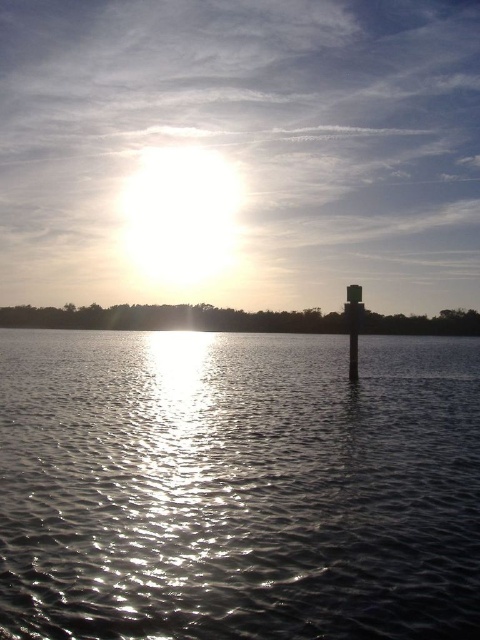
Question: Which object appears closest to the camera in this image?

Choices:
 (A) glistening silver water at center
 (B) smooth concrete pillar at center

Answer: (A)

Question: Which point is closer to the camera?

Choices:
 (A) smooth concrete pillar at center
 (B) glistening silver water at center

Answer: (B)

Question: In this image, where is glistening silver water at center located relative to smooth concrete pillar at center?

Choices:
 (A) left
 (B) right

Answer: (A)

Question: Is glistening silver water at center to the left of smooth concrete pillar at center from the viewer's perspective?

Choices:
 (A) no
 (B) yes

Answer: (B)

Question: Does glistening silver water at center have a larger size compared to smooth concrete pillar at center?

Choices:
 (A) no
 (B) yes

Answer: (B)